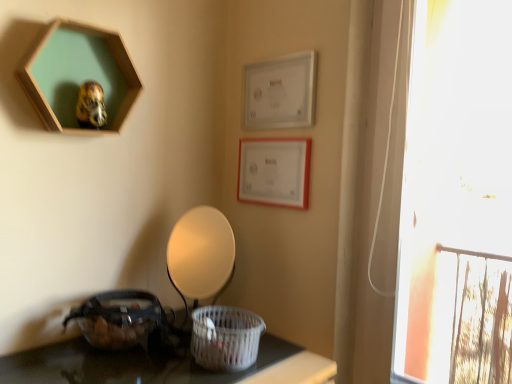
Question: Is translucent plastic basket at lower left, acting as the second basket starting from the right, to the right of matte white lampshade at center from the viewer's perspective?

Choices:
 (A) yes
 (B) no

Answer: (B)

Question: Is translucent plastic basket at lower left, acting as the second basket starting from the right, taller than matte white lampshade at center?

Choices:
 (A) yes
 (B) no

Answer: (B)

Question: From a real-world perspective, does translucent plastic basket at lower left, acting as the second basket starting from the right, stand above matte white lampshade at center?

Choices:
 (A) yes
 (B) no

Answer: (B)

Question: Is translucent plastic basket at lower left, the first basket from the left, further to the viewer compared to matte white lampshade at center?

Choices:
 (A) yes
 (B) no

Answer: (B)

Question: Is translucent plastic basket at lower left, the first basket from the left, completely or partially outside of matte white lampshade at center?

Choices:
 (A) yes
 (B) no

Answer: (A)

Question: Is point (309, 71) positioned closer to the camera than point (177, 221)?

Choices:
 (A) closer
 (B) farther

Answer: (A)

Question: In terms of height, does white matte picture frame at upper center, positioned as the third picture frame in left-to-right order, look taller or shorter compared to matte white lampshade at center?

Choices:
 (A) short
 (B) tall

Answer: (A)

Question: Looking at the image, does white matte picture frame at upper center, positioned as the third picture frame in left-to-right order, seem bigger or smaller compared to matte white lampshade at center?

Choices:
 (A) small
 (B) big

Answer: (A)

Question: Is white matte picture frame at upper center, which appears as the 1th picture frame when viewed from the right, wider or thinner than matte white lampshade at center?

Choices:
 (A) thin
 (B) wide

Answer: (A)

Question: From the image's perspective, relative to white woven basket at lower center, which is counted as the second basket, starting from the left, is transparent glass window at right above or below?

Choices:
 (A) below
 (B) above

Answer: (B)

Question: Is point (437, 3) positioned closer to the camera than point (236, 309)?

Choices:
 (A) closer
 (B) farther

Answer: (B)

Question: In terms of height, does transparent glass window at right look taller or shorter compared to white woven basket at lower center, which is the first basket in right-to-left order?

Choices:
 (A) tall
 (B) short

Answer: (A)

Question: Relative to white woven basket at lower center, which is counted as the second basket, starting from the left, is transparent glass window at right in front or behind?

Choices:
 (A) front
 (B) behind

Answer: (A)

Question: From the image's perspective, is translucent plastic basket at lower left, the first basket from the left, above or below matte white picture frame at upper right, which is the 2th picture frame in right-to-left order?

Choices:
 (A) below
 (B) above

Answer: (A)

Question: Considering their positions, is translucent plastic basket at lower left, acting as the second basket starting from the right, located in front of or behind matte white picture frame at upper right, acting as the 2th picture frame starting from the left?

Choices:
 (A) front
 (B) behind

Answer: (A)